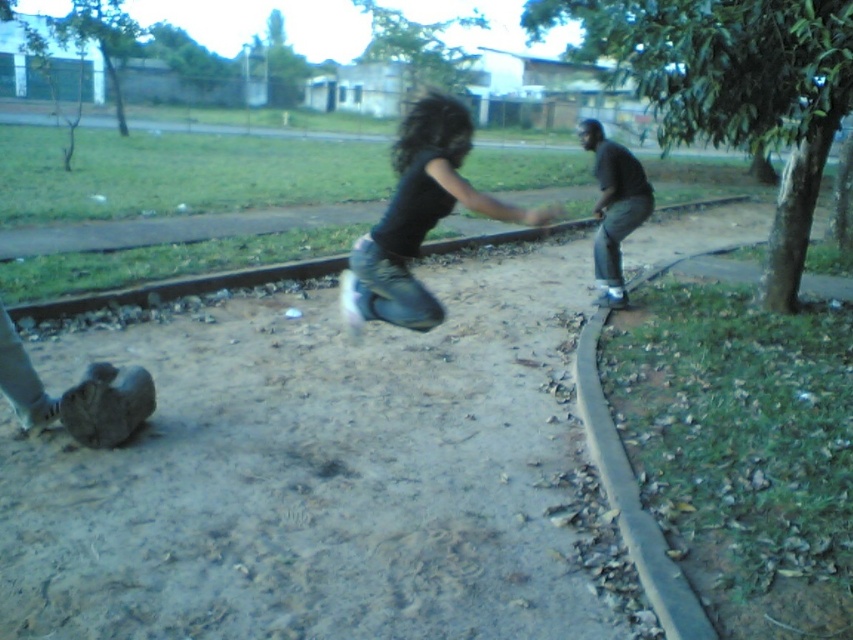
Question: Does green leafy tree at right have a larger size compared to green leafy tree at upper center?

Choices:
 (A) no
 (B) yes

Answer: (B)

Question: Which of these objects is positioned farthest from the black matte pants at center?

Choices:
 (A) green leafy tree at upper center
 (B) green leafy tree at upper left
 (C) green leafy tree at right

Answer: (A)

Question: Which point appears farthest from the camera in this image?

Choices:
 (A) (383, 51)
 (B) (636, 179)
 (C) (138, 35)

Answer: (A)

Question: Does black matte pants at center come in front of green leafy tree at upper left?

Choices:
 (A) no
 (B) yes

Answer: (B)

Question: Can you confirm if black matte jeans at center is positioned above green leafy tree at upper left?

Choices:
 (A) no
 (B) yes

Answer: (A)

Question: Which point is farther to the camera?

Choices:
 (A) black matte jeans at center
 (B) green leafy tree at upper left
 (C) black matte pants at center
 (D) green leafy tree at upper center

Answer: (D)